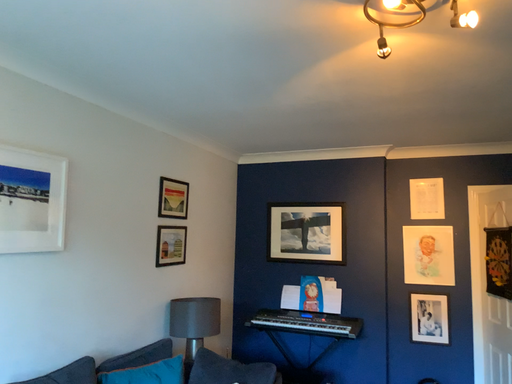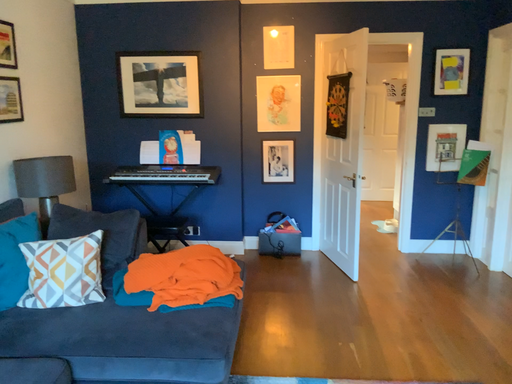
Question: How did the camera likely rotate when shooting the video?

Choices:
 (A) rotated left
 (B) rotated right

Answer: (B)